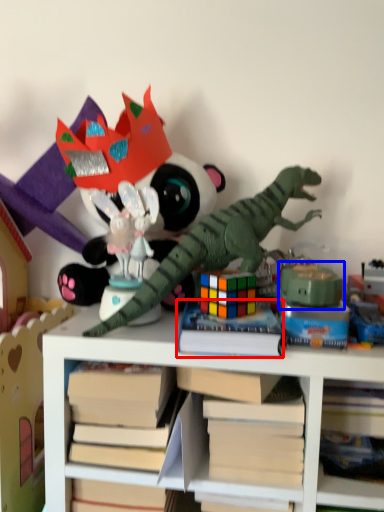
Question: Which object appears farthest to the camera in this image, paperback book (highlighted by a red box) or toy (highlighted by a blue box)?

Choices:
 (A) paperback book
 (B) toy

Answer: (B)